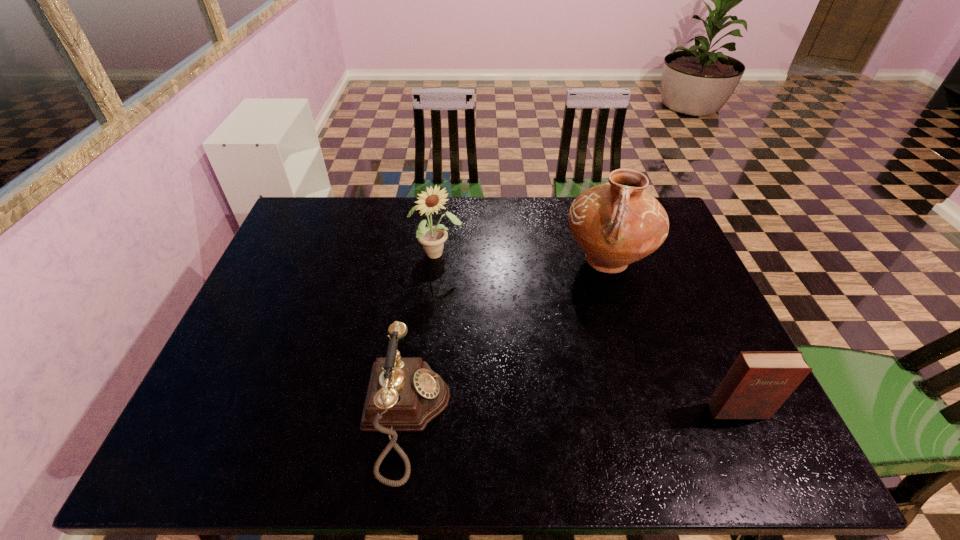
The image size is (960, 540). I want to click on vacant space on the desktop that is between the telephone and the diary and is positioned on the front-facing side of the sunflower, so click(537, 414).

Find the location of a particular element. This screenshot has width=960, height=540. free space on the desktop that is between the telephone and the diary and is positioned on the side of the pottery with the handle is located at coordinates (548, 414).